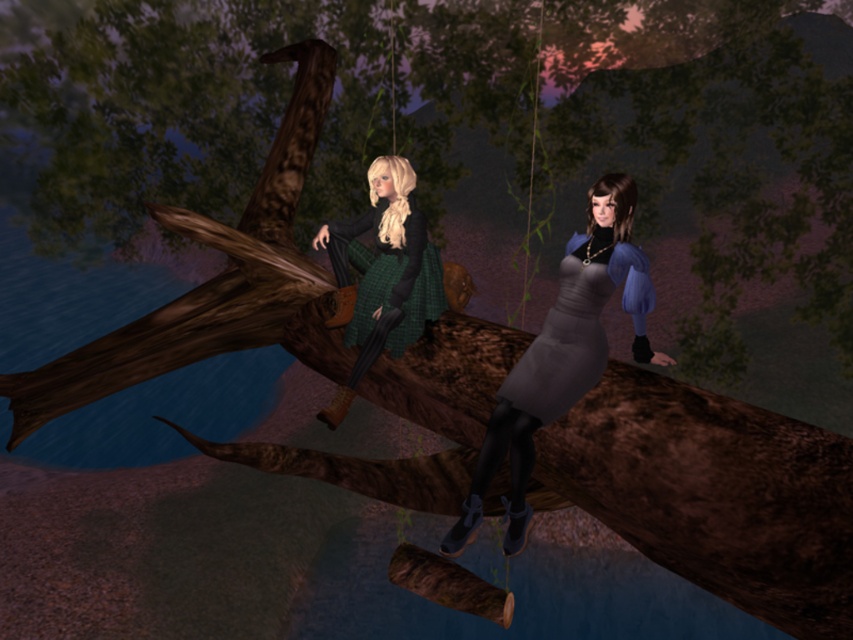
Question: Which point is closer to the camera taking this photo?

Choices:
 (A) (601, 336)
 (B) (404, 170)

Answer: (A)

Question: Does matte gray dress at center have a lesser width compared to green plaid dress at center?

Choices:
 (A) no
 (B) yes

Answer: (A)

Question: Observing the image, what is the correct spatial positioning of matte gray dress at center in reference to green plaid dress at center?

Choices:
 (A) right
 (B) left

Answer: (A)

Question: Among these points, which one is farthest from the camera?

Choices:
 (A) (418, 212)
 (B) (630, 282)

Answer: (A)

Question: Where is matte gray dress at center located in relation to green plaid dress at center in the image?

Choices:
 (A) below
 (B) above

Answer: (A)

Question: Which point is closer to the camera?

Choices:
 (A) green plaid dress at center
 (B) matte gray dress at center

Answer: (B)